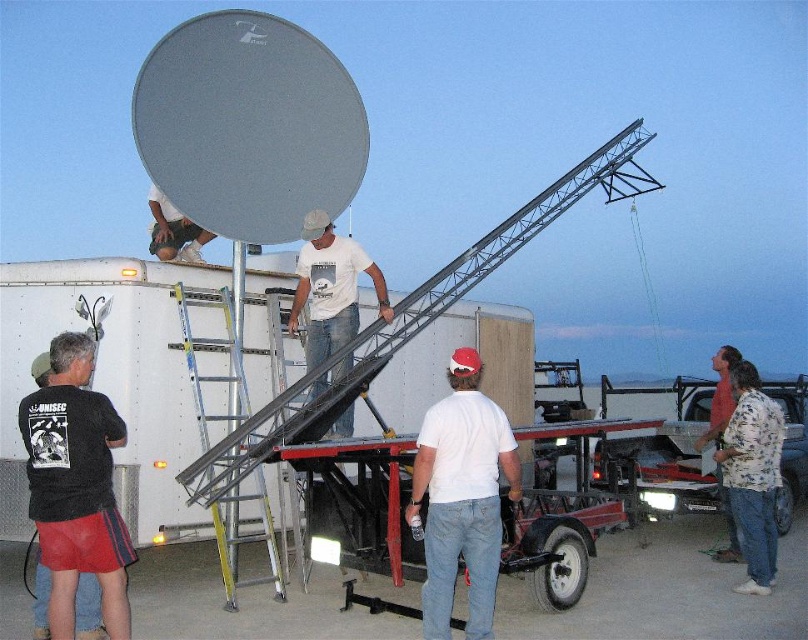
Question: Based on their relative distances, which object is farther from the white t-shirt at center?

Choices:
 (A) floral shirt at lower right
 (B) silver metallic ladder at center

Answer: (B)

Question: Which of the following is the closest to the observer?

Choices:
 (A) (213, 339)
 (B) (66, 634)

Answer: (B)

Question: Is white matte t-shirt at center smaller than silver metallic ladder at center?

Choices:
 (A) no
 (B) yes

Answer: (A)

Question: Which object appears closest to the camera in this image?

Choices:
 (A) white t-shirt at center
 (B) floral shirt at lower right

Answer: (B)

Question: Does white matte t-shirt at center appear over silver metallic ladder at center?

Choices:
 (A) yes
 (B) no

Answer: (A)

Question: Does white matte t-shirt at center appear over silver metallic ladder at center?

Choices:
 (A) yes
 (B) no

Answer: (A)